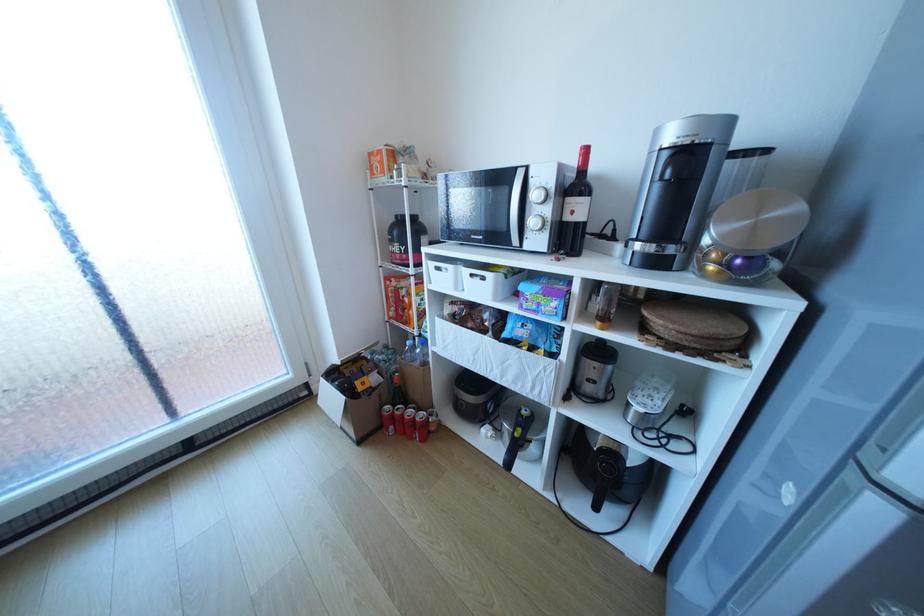
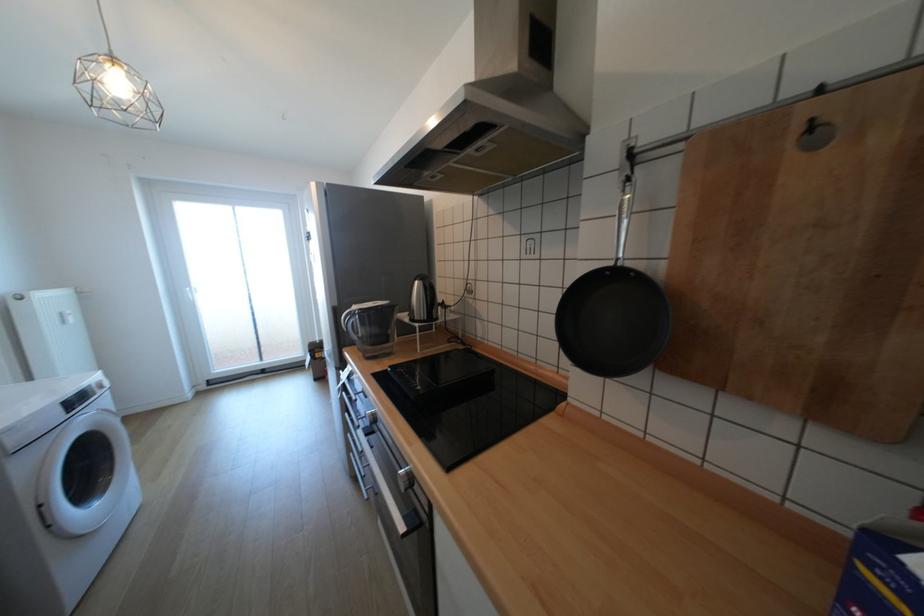
Looking at this image, in a continuous first-person perspective shot, in which direction is the camera moving?

The cameraman walked toward right, backward.